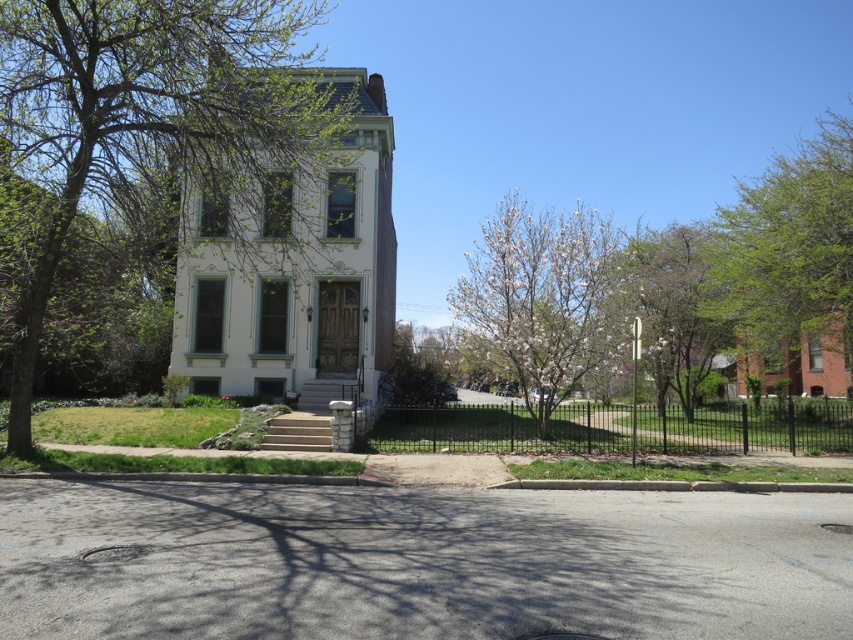
Question: Is white blossoming tree at center to the right of smooth white blossoms at center from the viewer's perspective?

Choices:
 (A) yes
 (B) no

Answer: (B)

Question: Which of the following is the closest to the observer?

Choices:
 (A) (641, 312)
 (B) (167, 136)

Answer: (B)

Question: Is green leafy tree at center thinner than green leafy tree at upper right?

Choices:
 (A) no
 (B) yes

Answer: (B)

Question: Which object is the closest to the smooth white blossoms at center?

Choices:
 (A) white blossoming tree at center
 (B) green leafy tree at upper right
 (C) green leafy tree at center

Answer: (B)

Question: Which object is farther from the camera taking this photo?

Choices:
 (A) smooth white blossoms at center
 (B) green leafy tree at upper right
 (C) white blossoming tree at center

Answer: (B)

Question: Does green leafy tree at center have a smaller size compared to white blossoming tree at center?

Choices:
 (A) no
 (B) yes

Answer: (A)